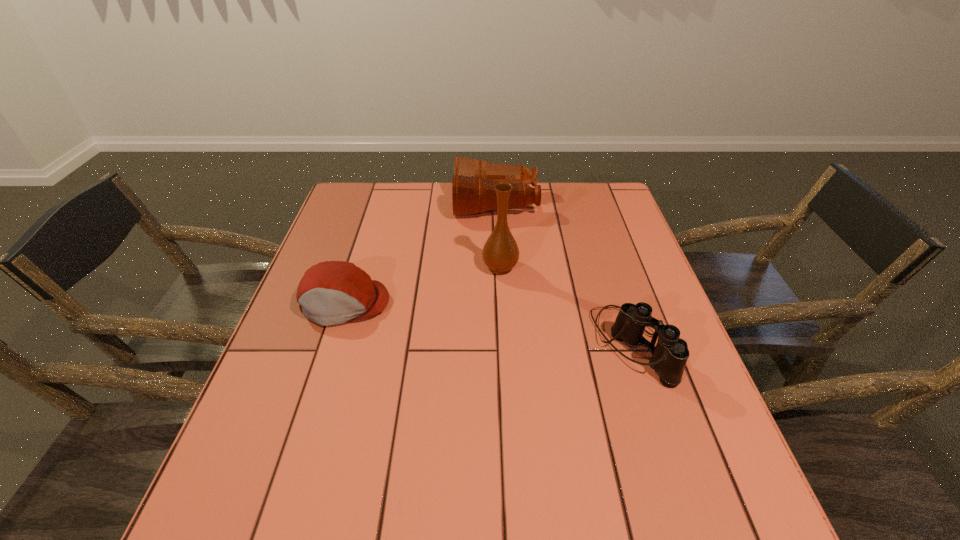
Where is `vacant area situated 0.130m through the lenses of the farthest object`? vacant area situated 0.130m through the lenses of the farthest object is located at coordinates (415, 203).

You are a GUI agent. You are given a task and a screenshot of the screen. Output one action in this format:
    pyautogui.click(x=<x>, y=<y>)
    Task: Click on the vacant space located through the lenses of the farthest object
    
    Given the screenshot: What is the action you would take?
    pyautogui.click(x=403, y=203)

Identify the location of free space located on the back of the rightmost object. The height and width of the screenshot is (540, 960). (599, 246).

Where is `vacant space located 0.240m on the front-facing side of the cap`? The image size is (960, 540). vacant space located 0.240m on the front-facing side of the cap is located at coordinates [307, 422].

Identify the location of object positioned at the far edge. (473, 191).

The width and height of the screenshot is (960, 540). In order to click on object at the left edge in this screenshot , I will do `click(332, 292)`.

At what (x,y) coordinates should I click in order to perform the action: click on object located at the right edge. Please return your answer as a coordinate pair (x, y). This screenshot has height=540, width=960. Looking at the image, I should click on [x=669, y=356].

In the image, there is a desktop. Where is `vacant space at the far edge`? Image resolution: width=960 pixels, height=540 pixels. vacant space at the far edge is located at coordinates (427, 194).

In order to click on free point at the near edge in this screenshot , I will do `click(471, 500)`.

The height and width of the screenshot is (540, 960). In the image, there is a desktop. In order to click on free space at the left edge in this screenshot , I will do `click(362, 257)`.